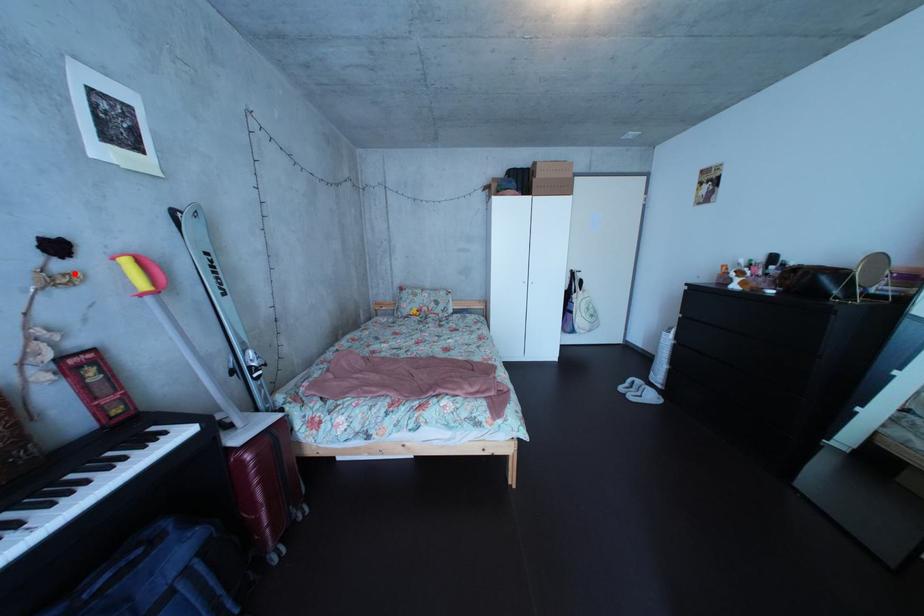
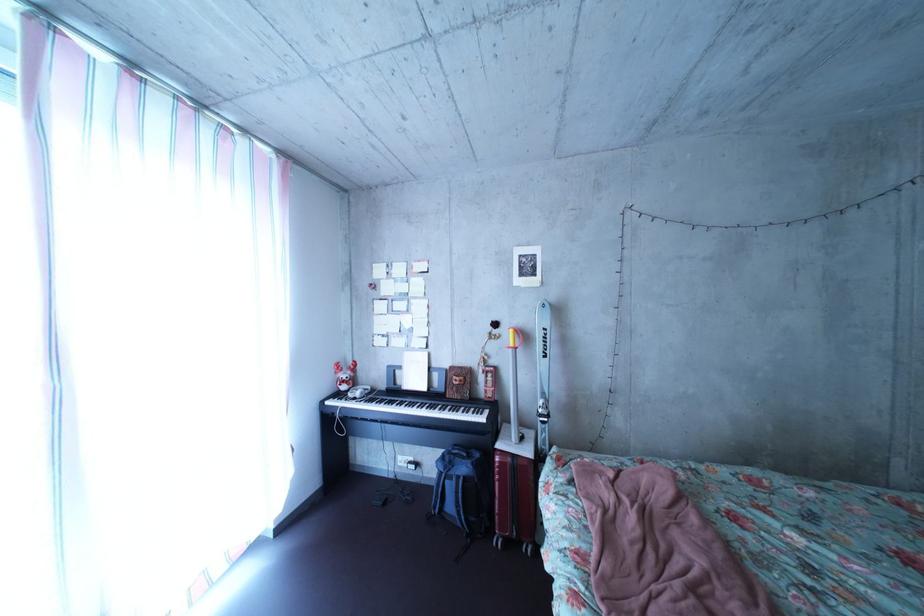
Find the pixel in the second image that matches the highlighted location in the first image.

(509, 339)